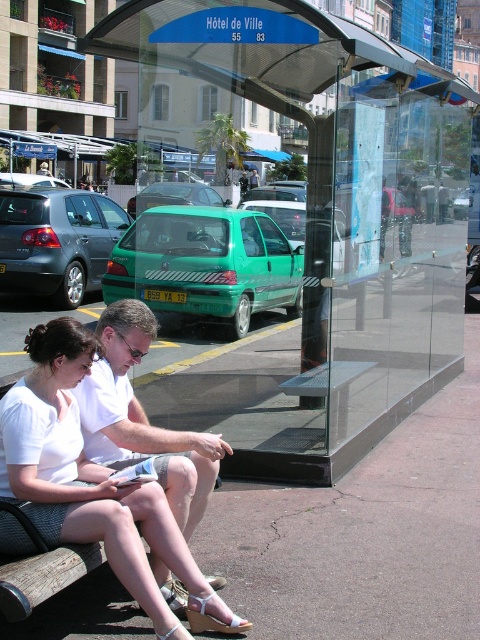
You are standing at the bus stop near Hotel de Ville and want to check the route numbers displayed on the blue roof. Where exactly should you look to see the transparent glass bus stop at center?

The transparent glass bus stop at center is located at point (315, 218), so you should look there to see the route numbers on its blue roof.

You are a delivery person who needs to place a 1.8 meter long package inside the transparent glass bus stop at center. Considering the height of the white cotton shirt at center, can the package fit vertically inside the bus stop?

The transparent glass bus stop at center is taller than the white cotton shirt at center. Since the white cotton shirt at center is likely around average human height, the bus stop is likely tall enough to accommodate the 1.8 meter package vertically.